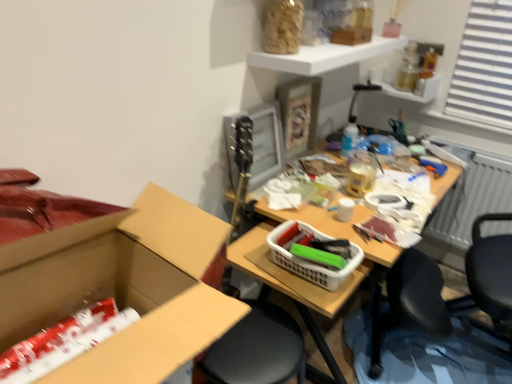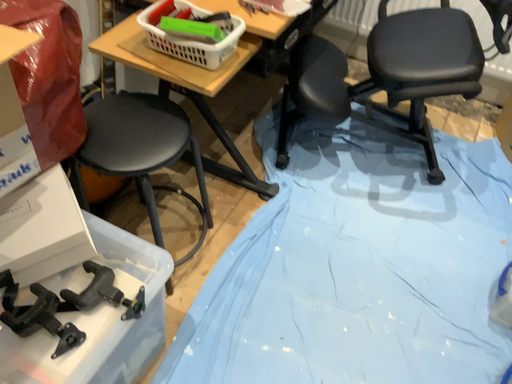
Question: Which way did the camera rotate in the video?

Choices:
 (A) rotated right
 (B) rotated left

Answer: (A)